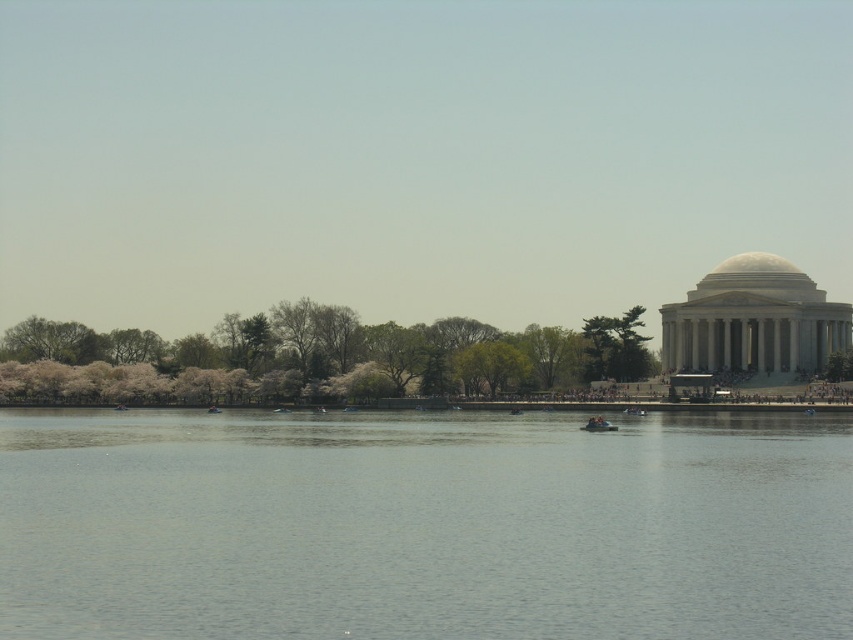
Question: Is gray water at center above fluffy white blossoms at center?

Choices:
 (A) yes
 (B) no

Answer: (B)

Question: Is gray water at center to the right of fluffy white blossoms at center from the viewer's perspective?

Choices:
 (A) no
 (B) yes

Answer: (B)

Question: Which point appears farthest from the camera in this image?

Choices:
 (A) (595, 419)
 (B) (833, 611)

Answer: (A)

Question: Can you confirm if gray water at center is positioned above matte orange boat at center?

Choices:
 (A) no
 (B) yes

Answer: (B)

Question: Among these points, which one is nearest to the camera?

Choices:
 (A) (90, 598)
 (B) (589, 429)
 (C) (646, 358)

Answer: (A)

Question: Estimate the real-world distances between objects in this image. Which object is closer to the gray water at center?

Choices:
 (A) green leafy tree at center
 (B) fluffy white blossoms at center
 (C) matte orange boat at center

Answer: (C)